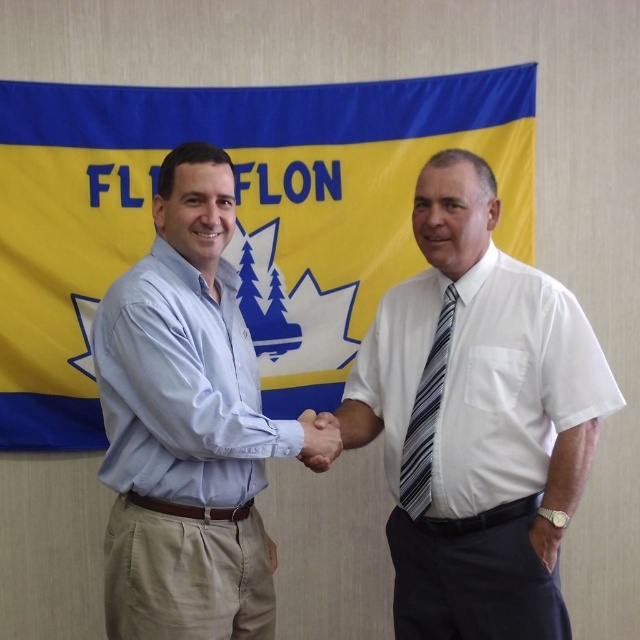
You are a photographer at the event and need to position a microphone stand between the light blue shirt at center and the striped fabric tie at center. Since the microphone stand requires 30 cm of space, can you place it between them?

The light blue shirt at center is to the left of striped fabric tie at center, so there is space between them. However, the exact distance isn not provided, so it is uncertain if 30 cm is available. You may need to measure the gap between them first.

Consider the image. You are standing in front of the banner at the event. There are two points marked in the image. The first point is at coordinates point (416,368) and the second is at point (237,538). Which point is closer to you?

Point (237,538) is closer to you because it is in front of point (416,368).

You are a photographer standing in front of the scene. You need to adjust your camera to focus on both the white striped tie at center and the light blue shirt at center simultaneously. Given the camera has a depth of field that can cover objects within 45 centimeters of each other, will both items be in focus?

The distance between the white striped tie at center and the light blue shirt at center is 43.93 centimeters, which is within the 45 centimeter depth of field range. Therefore, both items will be in focus.